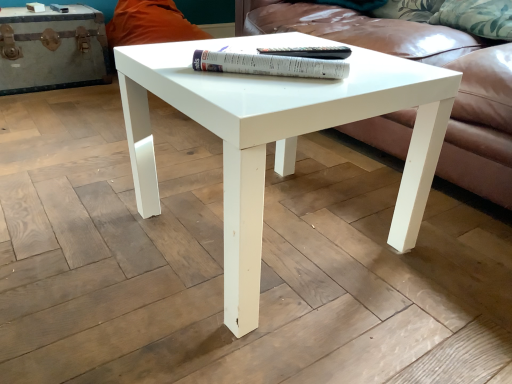
This screenshot has height=384, width=512. I want to click on vacant space in white glossy coffee table at center (from a real-world perspective), so click(272, 229).